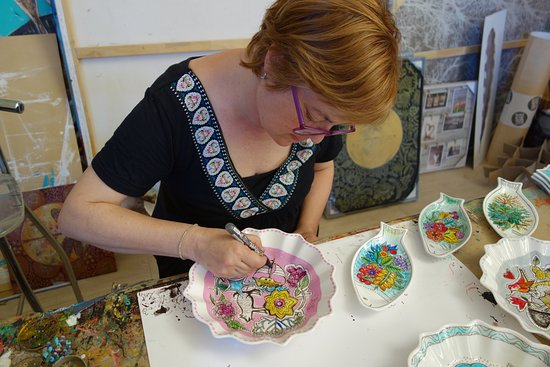
This screenshot has height=367, width=550. I want to click on white board, so click(x=360, y=337).